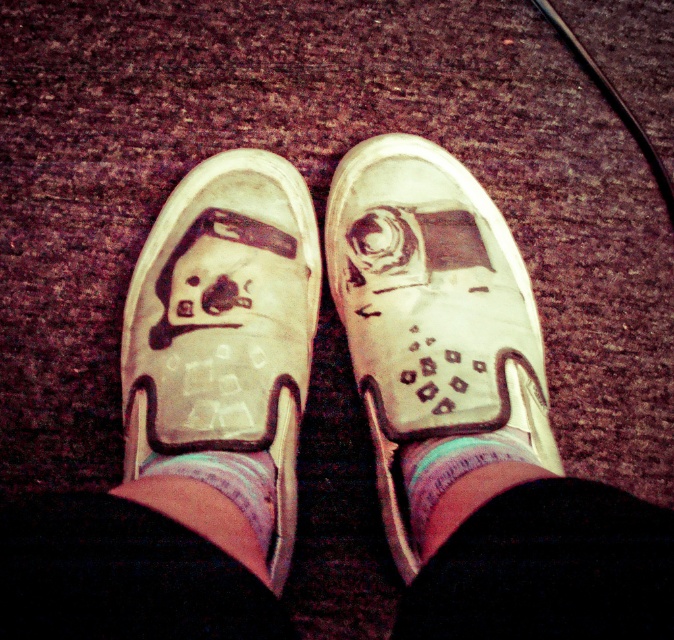
Does white canvas shoe at center have a lesser width compared to multicolored fabric sock at center?

No, white canvas shoe at center is not thinner than multicolored fabric sock at center.

What do you see at coordinates (431, 314) in the screenshot? The image size is (674, 640). I see `white canvas shoe at center` at bounding box center [431, 314].

Does point (450, 156) lie in front of point (450, 496)?

That is False.

Find the location of a particular element. This screenshot has height=640, width=674. white canvas shoe at center is located at coordinates (431, 314).

Is multicolored fabric sock at center closer to camera compared to white cotton sock at center?

That is True.

What do you see at coordinates (458, 472) in the screenshot?
I see `multicolored fabric sock at center` at bounding box center [458, 472].

Between point (537, 464) and point (251, 497), which one is positioned in front?

Positioned in front is point (251, 497).

The height and width of the screenshot is (640, 674). What are the coordinates of `multicolored fabric sock at center` in the screenshot? It's located at (458, 472).

Does white suede shoe at center have a lesser width compared to multicolored fabric sock at center?

In fact, white suede shoe at center might be wider than multicolored fabric sock at center.

Does white suede shoe at center have a smaller size compared to multicolored fabric sock at center?

No.

What do you see at coordinates (224, 324) in the screenshot? I see `white suede shoe at center` at bounding box center [224, 324].

Find the location of `white suede shoe at center`. white suede shoe at center is located at coordinates pos(224,324).